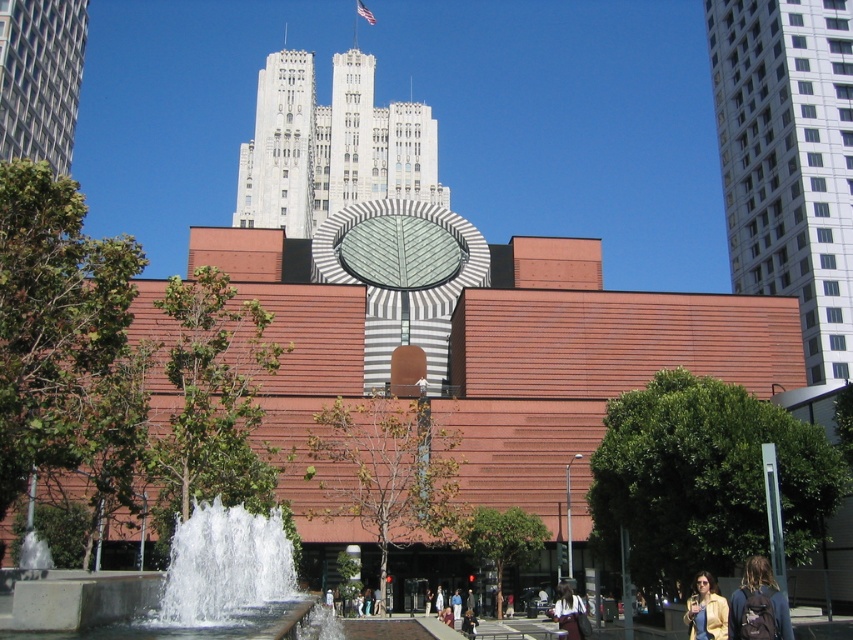
From the picture: Can you confirm if white textured building at upper right is shorter than metallic glass skyscraper at upper left?

No, white textured building at upper right is not shorter than metallic glass skyscraper at upper left.

Can you confirm if white textured building at upper right is bigger than metallic glass skyscraper at upper left?

Yes.

Which is behind, point (712, 52) or point (18, 131)?

The point (712, 52) is more distant.

Where is `white textured building at upper right`? white textured building at upper right is located at coordinates (788, 161).

Can you confirm if white stone tower at upper center is positioned to the left of dark brown leather jacket at lower center?

Correct, you'll find white stone tower at upper center to the left of dark brown leather jacket at lower center.

Can you confirm if white stone tower at upper center is smaller than dark brown leather jacket at lower center?

Actually, white stone tower at upper center might be larger than dark brown leather jacket at lower center.

Does point (265, 67) lie in front of point (563, 600)?

No.

Image resolution: width=853 pixels, height=640 pixels. Find the location of `white stone tower at upper center`. white stone tower at upper center is located at coordinates (329, 145).

Does clear glass water at center have a lesser height compared to yellow matte jacket at lower right?

No.

Can you confirm if clear glass water at center is positioned to the left of yellow matte jacket at lower right?

Indeed, clear glass water at center is positioned on the left side of yellow matte jacket at lower right.

Between point (166, 586) and point (709, 577), which one is positioned in front?

Point (166, 586) is in front.

Find the location of a particular element. Image resolution: width=853 pixels, height=640 pixels. clear glass water at center is located at coordinates (224, 577).